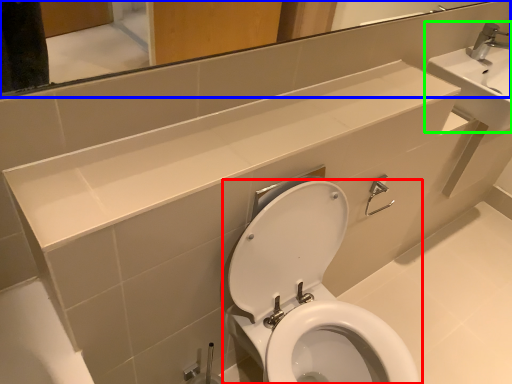
Question: Estimate the real-world distances between objects in this image. Which object is farther from toilet (highlighted by a red box), mirror (highlighted by a blue box) or sink (highlighted by a green box)?

Choices:
 (A) mirror
 (B) sink

Answer: (B)